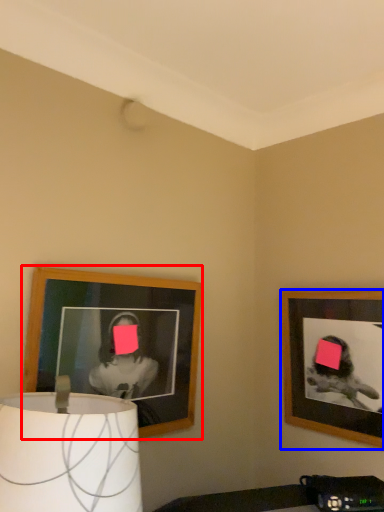
Question: Which point is further to the camera, picture frame (highlighted by a red box) or picture frame (highlighted by a blue box)?

Choices:
 (A) picture frame
 (B) picture frame

Answer: (B)